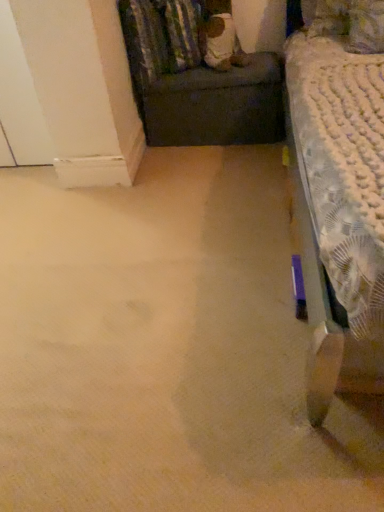
At what (x,y) coordinates should I click in order to perform the action: click on dark fabric ottoman at upper center. Please return your answer as a coordinate pair (x, y). Image resolution: width=384 pixels, height=512 pixels. Looking at the image, I should click on (198, 79).

Measure the distance between dark fabric ottoman at upper center and camera.

The depth of dark fabric ottoman at upper center is 2.03 meters.

What do you see at coordinates (198, 79) in the screenshot?
I see `dark fabric ottoman at upper center` at bounding box center [198, 79].

I want to click on dark fabric ottoman at upper center, so click(198, 79).